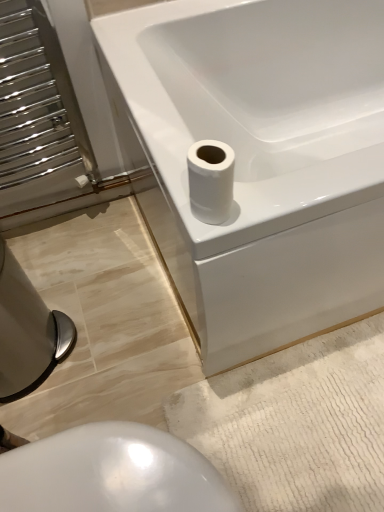
Question: Is white glossy bidet at lower center, which is counted as the 2th bidet, starting from the left, taller than white glossy toilet paper at upper right?

Choices:
 (A) no
 (B) yes

Answer: (B)

Question: Does white glossy bidet at lower center, which is the first bidet from right to left, appear on the left side of white glossy toilet paper at upper right?

Choices:
 (A) no
 (B) yes

Answer: (B)

Question: Considering the relative positions of white glossy bidet at lower center, which is counted as the 2th bidet, starting from the left, and white glossy toilet paper at upper right in the image provided, is white glossy bidet at lower center, which is counted as the 2th bidet, starting from the left, to the right of white glossy toilet paper at upper right from the viewer's perspective?

Choices:
 (A) yes
 (B) no

Answer: (B)

Question: Would you consider white glossy bidet at lower center, which is the first bidet from right to left, to be distant from white glossy toilet paper at upper right?

Choices:
 (A) no
 (B) yes

Answer: (A)

Question: From a real-world perspective, is white glossy bidet at lower center, which is counted as the 2th bidet, starting from the left, on white glossy toilet paper at upper right?

Choices:
 (A) no
 (B) yes

Answer: (A)

Question: In terms of height, does white glossy bathtub at upper right look taller or shorter compared to brushed metal bidet at lower left, the second bidet positioned from the right?

Choices:
 (A) tall
 (B) short

Answer: (A)

Question: Visually, is white glossy bathtub at upper right positioned to the left or to the right of brushed metal bidet at lower left, the second bidet positioned from the right?

Choices:
 (A) right
 (B) left

Answer: (A)

Question: From the image's perspective, is white glossy bathtub at upper right above or below brushed metal bidet at lower left, which ranks as the first bidet in left-to-right order?

Choices:
 (A) below
 (B) above

Answer: (B)

Question: In terms of width, does white glossy bathtub at upper right look wider or thinner when compared to brushed metal bidet at lower left, the second bidet positioned from the right?

Choices:
 (A) thin
 (B) wide

Answer: (B)

Question: Considering the positions of point (203, 206) and point (72, 480), is point (203, 206) closer or farther from the camera than point (72, 480)?

Choices:
 (A) farther
 (B) closer

Answer: (A)

Question: From a real-world perspective, relative to white glossy bidet at lower center, which is the first bidet from right to left, is white glossy toilet paper at upper right vertically above or below?

Choices:
 (A) above
 (B) below

Answer: (A)

Question: Would you say white glossy toilet paper at upper right is inside or outside white glossy bidet at lower center, which is counted as the 2th bidet, starting from the left?

Choices:
 (A) inside
 (B) outside

Answer: (B)

Question: Considering the positions of white glossy toilet paper at upper right and white glossy bidet at lower center, which is the first bidet from right to left, in the image, is white glossy toilet paper at upper right taller or shorter than white glossy bidet at lower center, which is the first bidet from right to left,?

Choices:
 (A) tall
 (B) short

Answer: (B)

Question: Visually, is brushed metal bidet at lower left, which ranks as the first bidet in left-to-right order, positioned to the left or to the right of white glossy bathtub at upper right?

Choices:
 (A) right
 (B) left

Answer: (B)

Question: From a real-world perspective, is brushed metal bidet at lower left, which ranks as the first bidet in left-to-right order, above or below white glossy bathtub at upper right?

Choices:
 (A) below
 (B) above

Answer: (A)